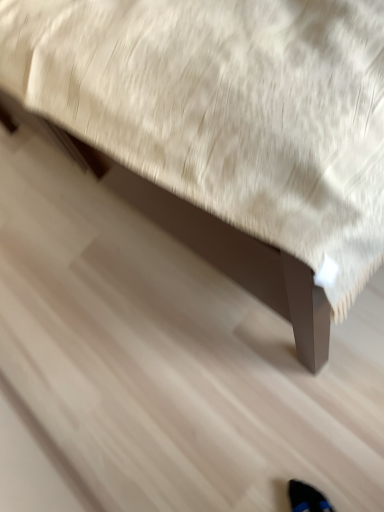
In order to face brown matte bed frame at lower center, should I rotate leftwards or rightwards?

You should look right and rotate roughly 3.666 degrees.

Image resolution: width=384 pixels, height=512 pixels. I want to click on brown matte bed frame at lower center, so click(229, 117).

This screenshot has width=384, height=512. Describe the element at coordinates (229, 117) in the screenshot. I see `brown matte bed frame at lower center` at that location.

Find the location of a particular element. This screenshot has height=512, width=384. brown matte bed frame at lower center is located at coordinates (229, 117).